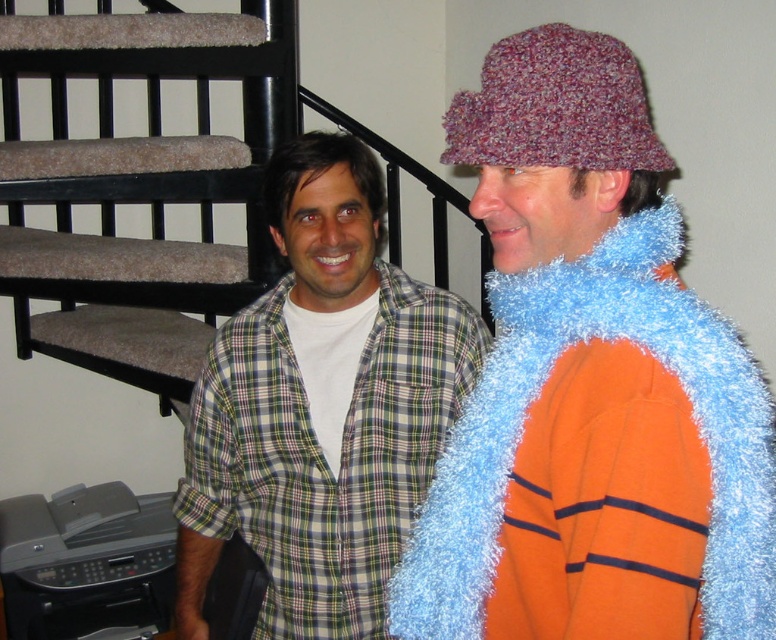
You are trying to locate the black plastic printer at lower left in the image. Which direction should you look relative to the fluffy blue scarf at right?

The fluffy blue scarf at right is located above the black plastic printer at lower left, so you should look downward from the fluffy blue scarf at right to find the black plastic printer at lower left.

From the picture: You need to place a rectangular gift box that is 30 cm wide on the floor between the fluffy blue scarf at right and the black plastic printer at lower left. Based on their widths, can the gift box fit between them?

The fluffy blue scarf at right is narrower than the black plastic printer at lower left. Since the gift box is 30 cm wide, it depends on the actual distance between them. However, the question only provides information about their widths, not the space between. Therefore, we cannot determine if the gift box will fit based on the given details.